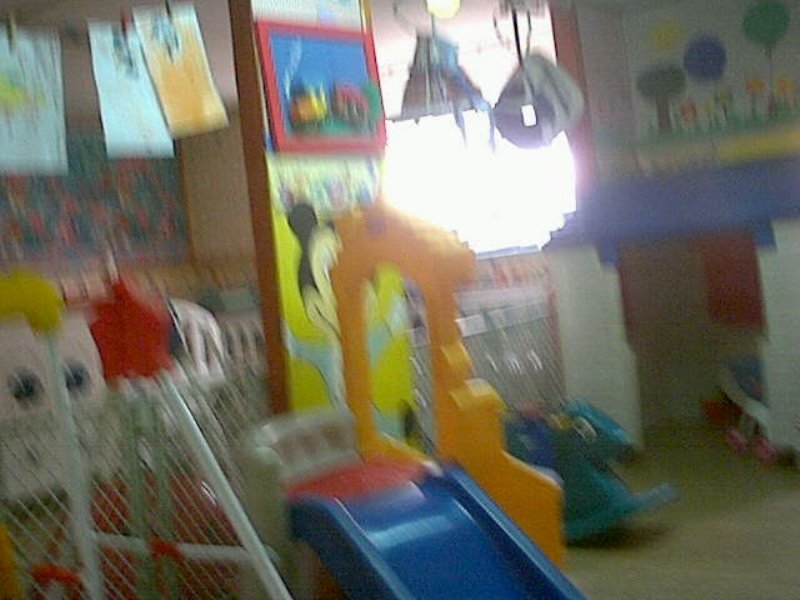
Locate an element on the screen. The width and height of the screenshot is (800, 600). bright light is located at coordinates (480, 186).